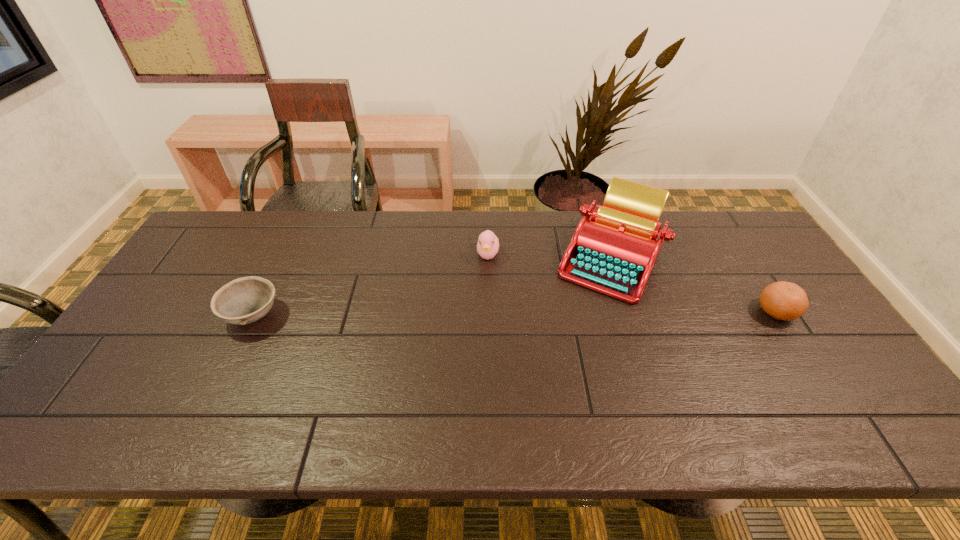
This screenshot has height=540, width=960. Find the location of `free space on the desktop that is between the bowl and the rightmost object and is positioned on the front-facing side of the duckling`. free space on the desktop that is between the bowl and the rightmost object and is positioned on the front-facing side of the duckling is located at coordinates (487, 314).

Locate an element on the screen. The height and width of the screenshot is (540, 960). free space on the desktop that is between the leftmost object and the clementine and is positioned on the typing side of the second object from right to left is located at coordinates tap(497, 314).